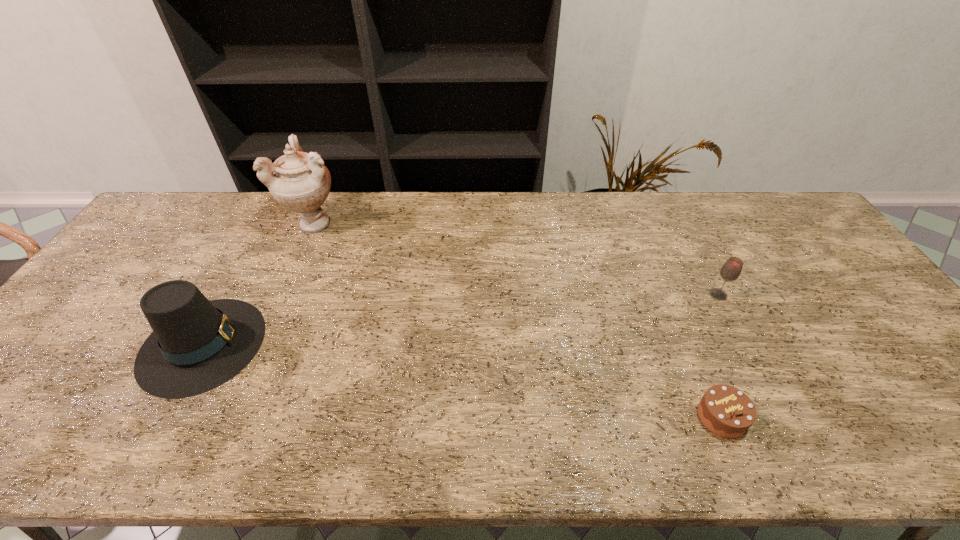
The width and height of the screenshot is (960, 540). What are the coordinates of `the farthest object` in the screenshot? It's located at (299, 181).

At what (x,y) coordinates should I click in order to perform the action: click on urn. Please return your answer as a coordinate pair (x, y). Looking at the image, I should click on (299, 181).

This screenshot has height=540, width=960. Identify the location of the second tallest object. (197, 345).

Image resolution: width=960 pixels, height=540 pixels. What are the coordinates of `the rightmost object` in the screenshot? It's located at (731, 270).

This screenshot has width=960, height=540. What are the coordinates of `glass drink container` in the screenshot? It's located at (731, 270).

Where is `the shortest object`? the shortest object is located at coordinates (726, 411).

Locate an element on the screen. chocolate cake is located at coordinates (726, 411).

Locate an element on the screen. The width and height of the screenshot is (960, 540). vacant region located 0.080m on the left of the farthest object is located at coordinates (263, 224).

Identify the location of vacant space located 0.280m on the front-facing side of the second tallest object. The image size is (960, 540). (373, 344).

You are a GUI agent. You are given a task and a screenshot of the screen. Output one action in this format:
    pyautogui.click(x=<x>, y=<y>)
    Task: Click on the vacant space located 0.380m on the back of the glass drink container
    
    Given the screenshot: What is the action you would take?
    pyautogui.click(x=673, y=209)